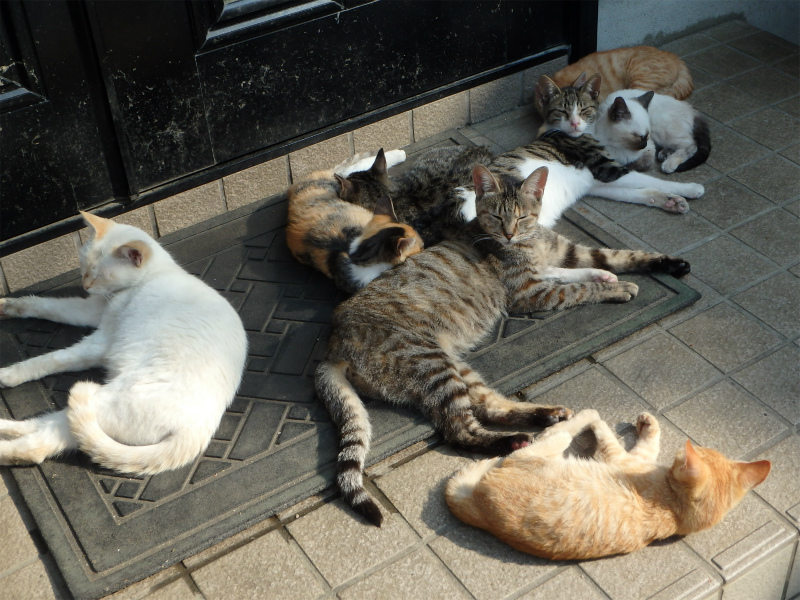
I want to click on right front leg, so click(x=50, y=307).